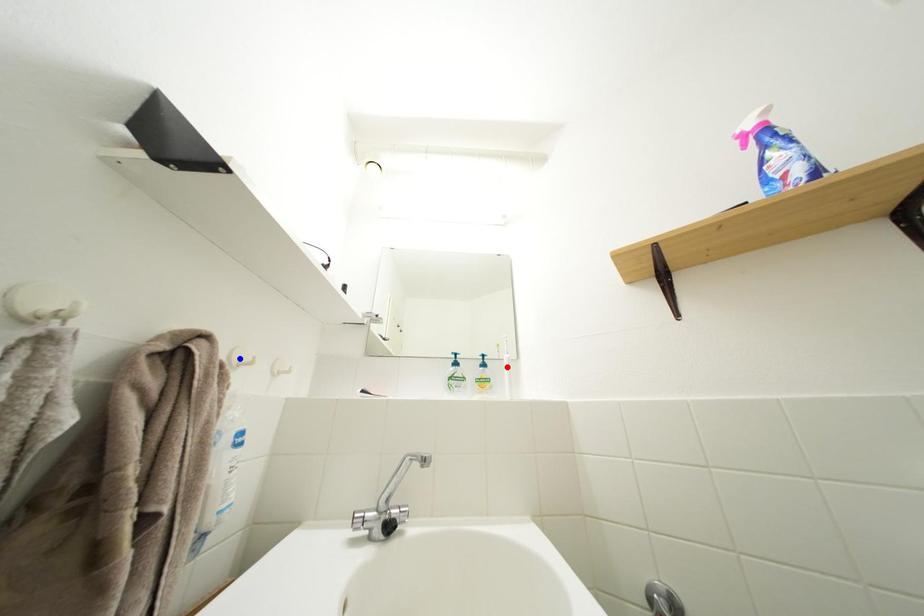
Question: Which of the two points in the image is closer to the camera?

Choices:
 (A) Blue point is closer.
 (B) Red point is closer.

Answer: (A)